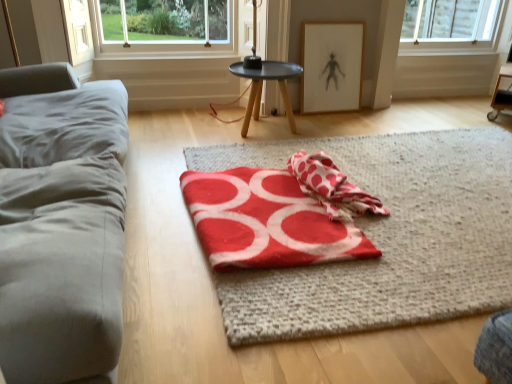
This screenshot has height=384, width=512. Find the location of `vacant space underneath matte black table at center (from a real-world perspective)`. vacant space underneath matte black table at center (from a real-world perspective) is located at coordinates (262, 134).